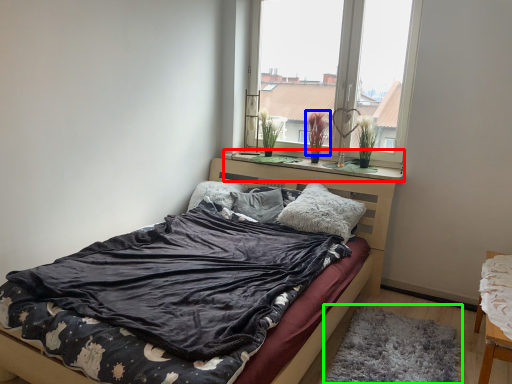
Question: Considering the real-world distances, which object is farthest from window sill (highlighted by a red box)? plant (highlighted by a blue box) or mat (highlighted by a green box)?

Choices:
 (A) plant
 (B) mat

Answer: (B)